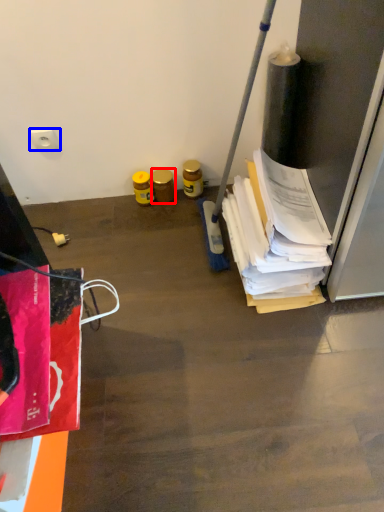
Question: Which object appears farthest to the camera in this image, bottle (highlighted by a red box) or power plugs and sockets (highlighted by a blue box)?

Choices:
 (A) bottle
 (B) power plugs and sockets

Answer: (A)